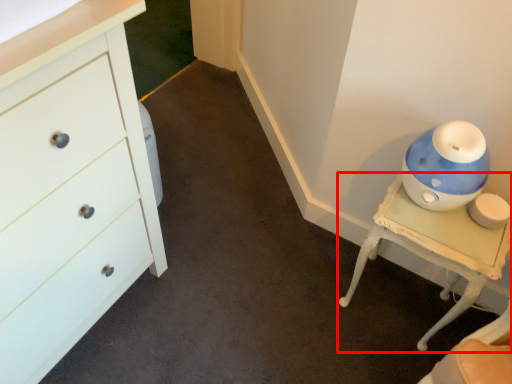
Question: In this image, where is furniture (annotated by the red box) located relative to chest of drawers?

Choices:
 (A) left
 (B) right

Answer: (B)